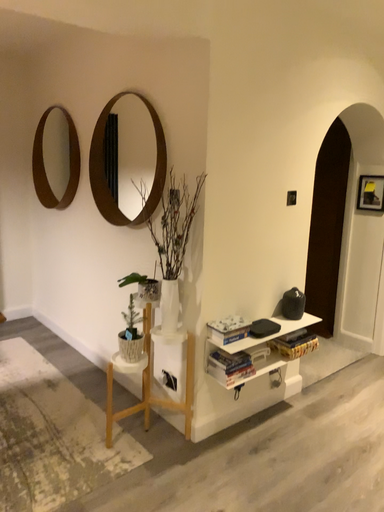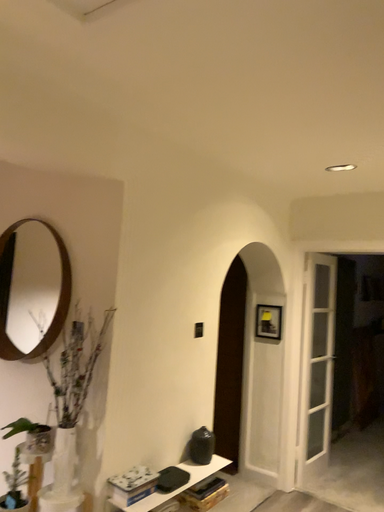
Question: Which way did the camera rotate in the video?

Choices:
 (A) rotated downward
 (B) rotated upward

Answer: (B)